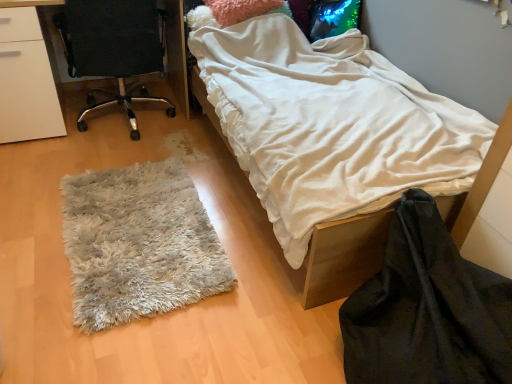
Question: Considering the positions of white fluffy rug at lower left and black velvet blanket at lower right in the image, is white fluffy rug at lower left taller or shorter than black velvet blanket at lower right?

Choices:
 (A) short
 (B) tall

Answer: (A)

Question: Do you think white fluffy rug at lower left is within black velvet blanket at lower right, or outside of it?

Choices:
 (A) inside
 (B) outside

Answer: (B)

Question: Which object is the farthest from the white soft blanket at center?

Choices:
 (A) white fluffy rug at lower left
 (B) black fabric chair at left
 (C) black velvet blanket at lower right

Answer: (B)

Question: Based on their relative distances, which object is farther from the white soft blanket at center?

Choices:
 (A) black velvet blanket at lower right
 (B) white fluffy rug at lower left
 (C) black fabric chair at left

Answer: (C)